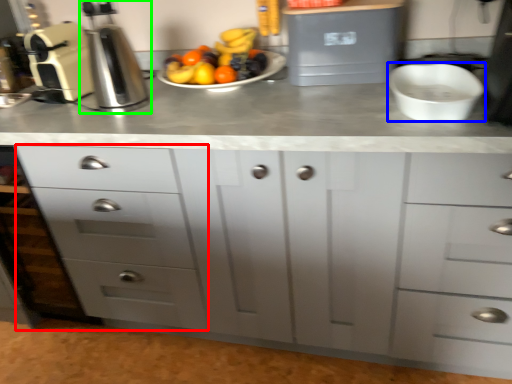
Question: Considering the real-world distances, which object is farthest from drawer (highlighted by a red box)? mixing bowl (highlighted by a blue box) or coffee machine (highlighted by a green box)?

Choices:
 (A) mixing bowl
 (B) coffee machine

Answer: (A)